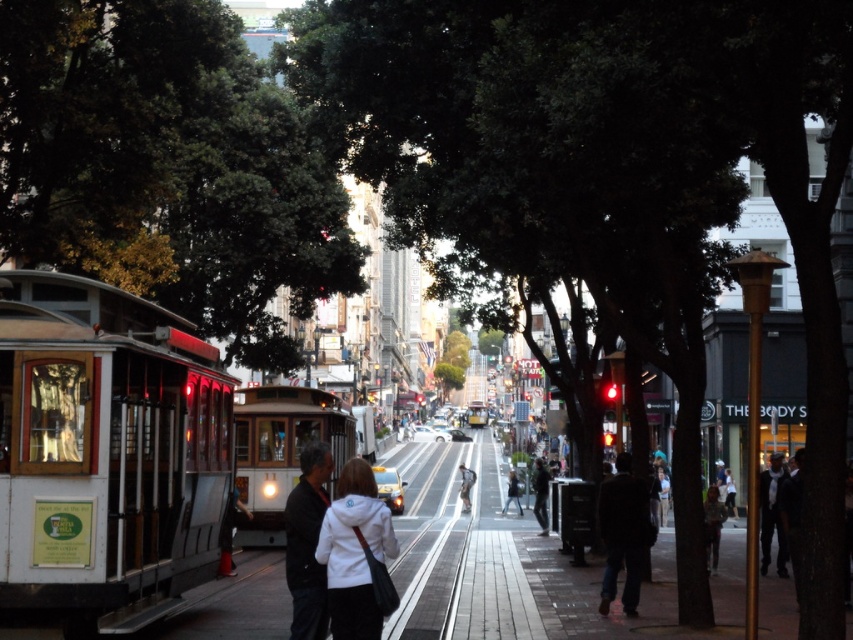
Is green leafy tree at upper left further to camera compared to black fabric jacket at center?

Yes, it is behind black fabric jacket at center.

Does point (276, 86) come farther from viewer compared to point (317, 592)?

Yes, it is.

This screenshot has height=640, width=853. In order to click on green leafy tree at upper left in this screenshot , I will do `click(166, 166)`.

Between polished wood cable car at left and dark blue jeans at lower right, which one appears on the left side from the viewer's perspective?

polished wood cable car at left is more to the left.

Can you confirm if polished wood cable car at left is positioned to the left of dark blue jeans at lower right?

Indeed, polished wood cable car at left is positioned on the left side of dark blue jeans at lower right.

Who is more forward, (102, 481) or (631, 580)?

Point (102, 481) is more forward.

Identify the location of polished wood cable car at left. Image resolution: width=853 pixels, height=640 pixels. pos(105,452).

Is green leafy tree at upper left above polished brass cable car at left?

Yes.

Is green leafy tree at upper left to the right of polished brass cable car at left from the viewer's perspective?

Incorrect, green leafy tree at upper left is not on the right side of polished brass cable car at left.

Who is more forward, (238, 342) or (294, 452)?

Point (294, 452)

Locate an element on the screen. This screenshot has width=853, height=640. green leafy tree at upper left is located at coordinates (166, 166).